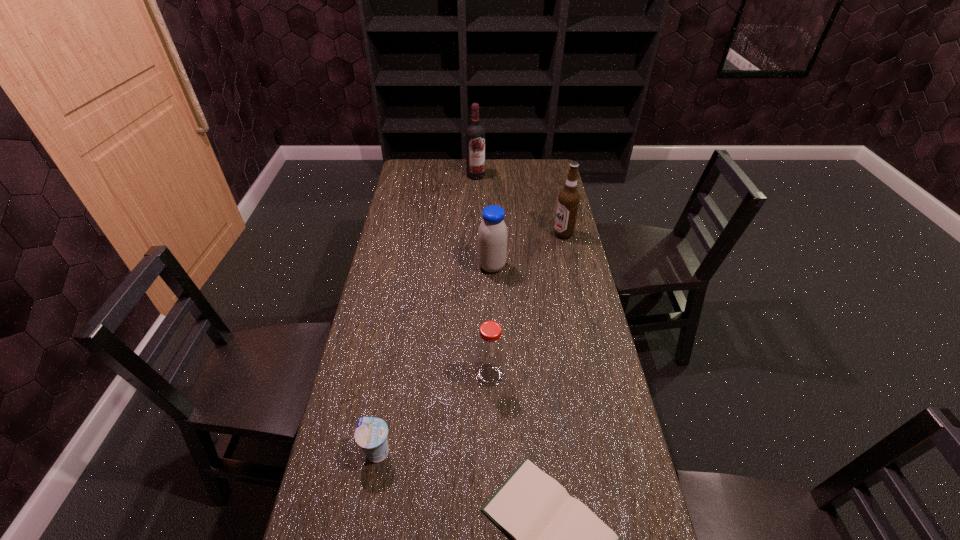
Where is `wine bottle`? The image size is (960, 540). wine bottle is located at coordinates (475, 134).

Find the location of a particular element. the second farthest object is located at coordinates (568, 201).

At what (x,y) coordinates should I click in order to perform the action: click on the fourth nearest object. Please return your answer as a coordinate pair (x, y). Looking at the image, I should click on (x=492, y=235).

Where is `soya milk`? This screenshot has height=540, width=960. soya milk is located at coordinates (492, 235).

You are a GUI agent. You are given a task and a screenshot of the screen. Output one action in this format:
    pyautogui.click(x=<x>, y=<y>)
    Task: Click on the bottle
    This screenshot has width=960, height=540.
    Given the screenshot: What is the action you would take?
    pyautogui.click(x=490, y=347)

Where is `the fourth farthest object`? Image resolution: width=960 pixels, height=540 pixels. the fourth farthest object is located at coordinates (490, 347).

Identify the location of the second shortest object. This screenshot has height=540, width=960. (371, 433).

This screenshot has height=540, width=960. In order to click on the leftmost object in this screenshot , I will do `click(371, 433)`.

Locate an element on the screen. vacant space situated 0.240m on the label of the farthest object is located at coordinates (475, 210).

Where is `free space located on the label of the alcohol`? Image resolution: width=960 pixels, height=540 pixels. free space located on the label of the alcohol is located at coordinates (540, 234).